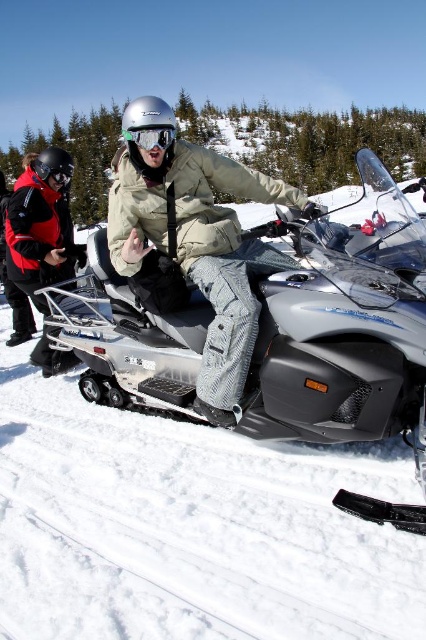
Question: Where is metallic silver snowmobile at center located in relation to red jacket at left in the image?

Choices:
 (A) below
 (B) above

Answer: (B)

Question: Among these objects, which one is farthest from the camera?

Choices:
 (A) metallic silver snowmobile at center
 (B) light beige fabric jacket at center
 (C) red jacket at left

Answer: (C)

Question: Is light beige fabric jacket at center bigger than red jacket at left?

Choices:
 (A) no
 (B) yes

Answer: (B)

Question: Which object is closer to the camera taking this photo?

Choices:
 (A) clear plastic goggles at center
 (B) light beige fabric jacket at center

Answer: (B)

Question: Does red jacket at left lie behind clear plastic goggles at center?

Choices:
 (A) no
 (B) yes

Answer: (B)

Question: Among these points, which one is nearest to the camera?

Choices:
 (A) (169, 134)
 (B) (371, 349)
 (C) (213, 269)

Answer: (B)